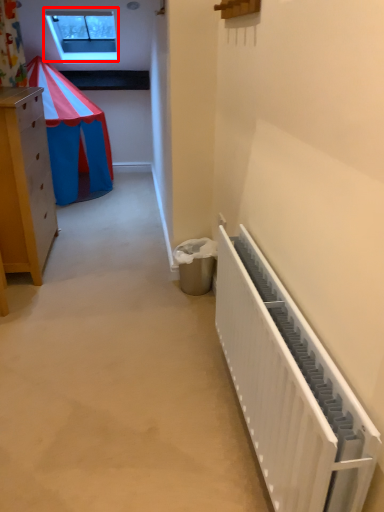
Question: Considering the relative positions of window (annotated by the red box) and radiator in the image provided, where is window (annotated by the red box) located with respect to the staircase?

Choices:
 (A) right
 (B) left

Answer: (B)